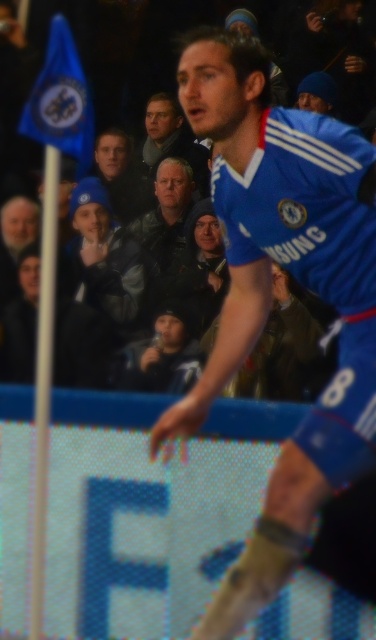
Question: Does blue jersey at center appear on the right side of dark blue jacket at center?

Choices:
 (A) yes
 (B) no

Answer: (A)

Question: Is blue jersey at center positioned before dark blue jacket at center?

Choices:
 (A) yes
 (B) no

Answer: (A)

Question: Which of the following is the farthest from the observer?

Choices:
 (A) (147, 141)
 (B) (235, 317)

Answer: (A)

Question: Is blue jersey at center below dark blue jacket at center?

Choices:
 (A) no
 (B) yes

Answer: (B)